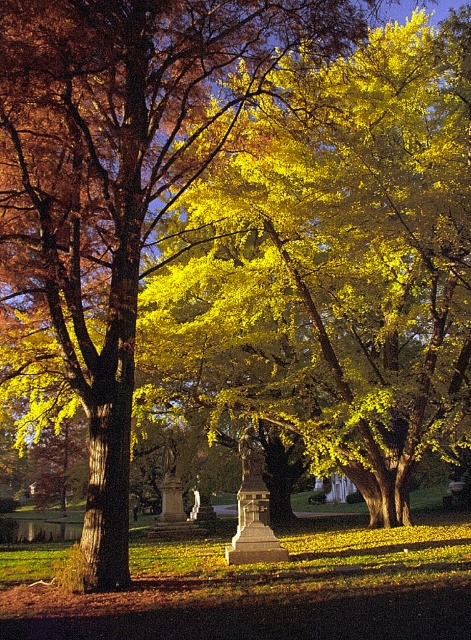
Question: Is yellow/golden leaves at center to the right of golden yellow leaves at center from the viewer's perspective?

Choices:
 (A) yes
 (B) no

Answer: (A)

Question: Which of the following is the farthest from the observer?

Choices:
 (A) golden yellow leaves at center
 (B) yellow/golden leaves at center

Answer: (B)

Question: In this image, where is yellow/golden leaves at center located relative to golden yellow leaves at center?

Choices:
 (A) left
 (B) right

Answer: (B)

Question: Can you confirm if yellow/golden leaves at center is thinner than golden yellow leaves at center?

Choices:
 (A) yes
 (B) no

Answer: (B)

Question: Which of the following is the farthest from the observer?

Choices:
 (A) (413, 342)
 (B) (89, 93)

Answer: (A)